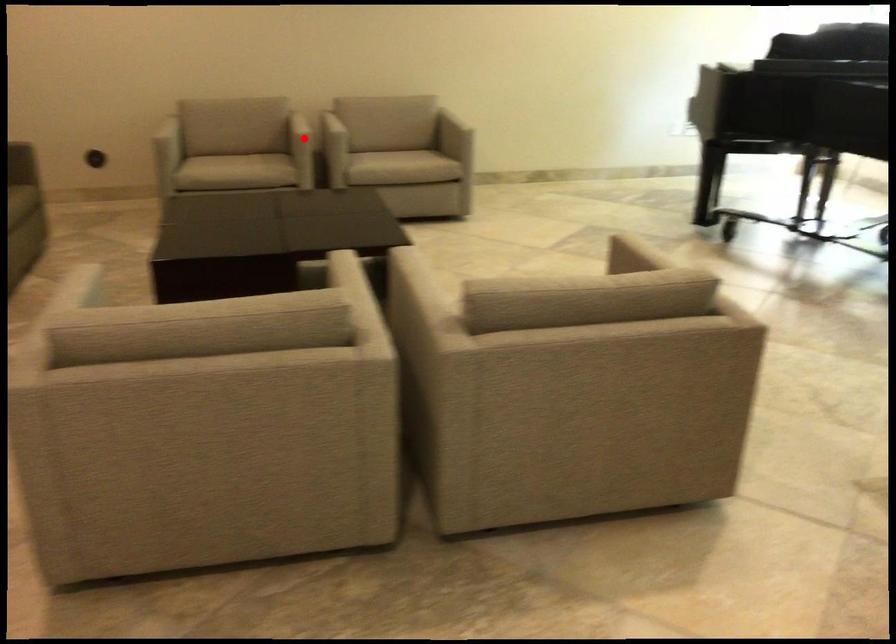
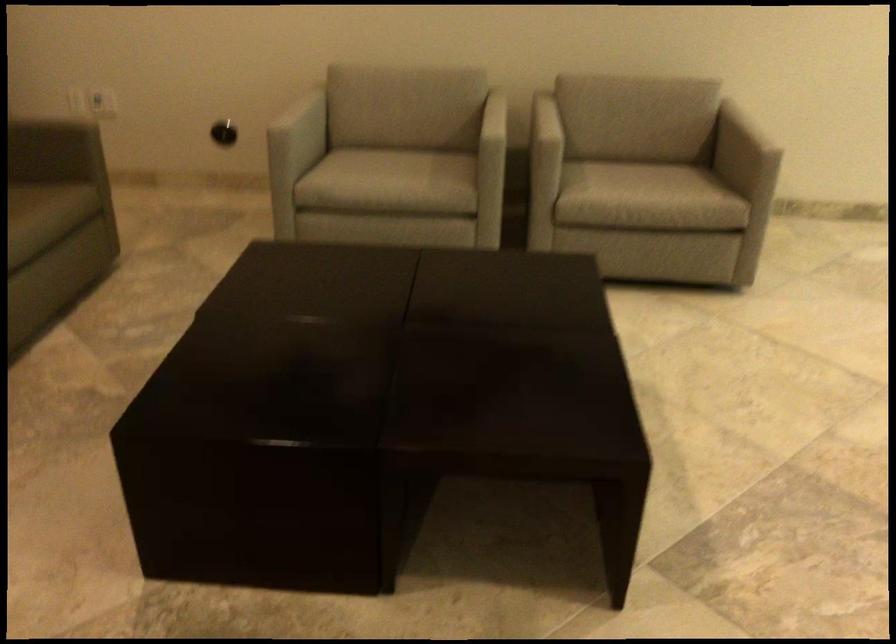
Where in the second image is the point corresponding to the highlighted location from the first image?

(492, 151)